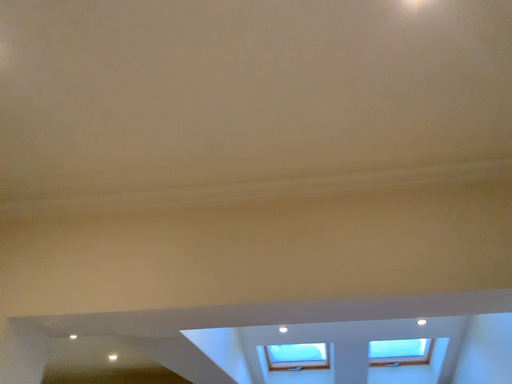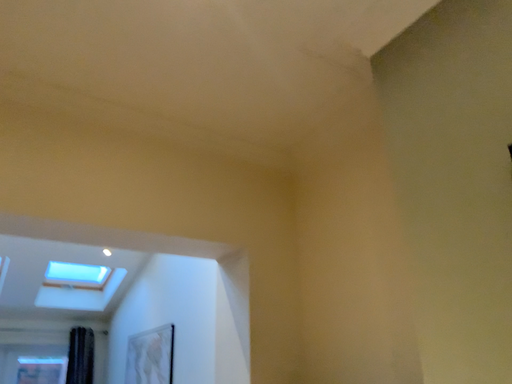
Question: Which way did the camera rotate in the video?

Choices:
 (A) rotated right
 (B) rotated left

Answer: (A)